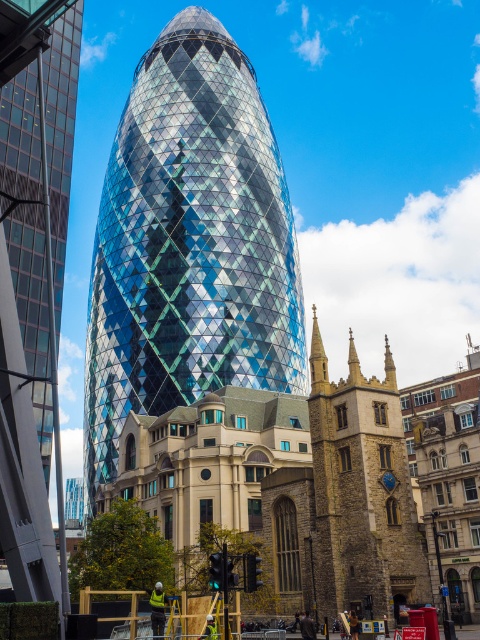
You are a city planner analyzing the skyline. Which of the two buildings, the shiny glass tower at center or the shiny glass skyscraper at center, has a narrower width?

The shiny glass tower at center is thinner than the shiny glass skyscraper at center, so it has a narrower width.

You are an architect analyzing the cityscape. You notice two prominent structures, the shiny glass tower at center and the shiny glass skyscraper at center. Based on their positions, which one is located to the right of the other?

The shiny glass tower at center is positioned on the right side of the shiny glass skyscraper at center.

You are an architect analyzing the cityscape. You observe the shiny glass tower at center and the shiny glass skyscraper at center. Which of these two structures is taller?

The shiny glass tower at center is taller than the shiny glass skyscraper at center according to the description provided.